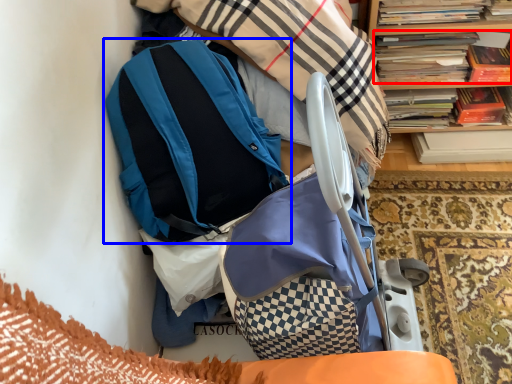
Question: Which object appears closest to the camera in this image, book (highlighted by a red box) or backpack (highlighted by a blue box)?

Choices:
 (A) book
 (B) backpack

Answer: (B)